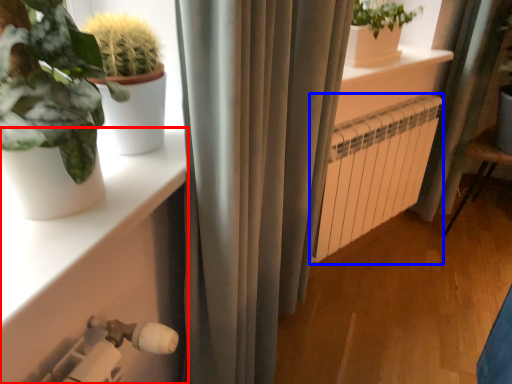
Question: Among these objects, which one is farthest to the camera, shelf (highlighted by a red box) or radiator (highlighted by a blue box)?

Choices:
 (A) shelf
 (B) radiator

Answer: (B)